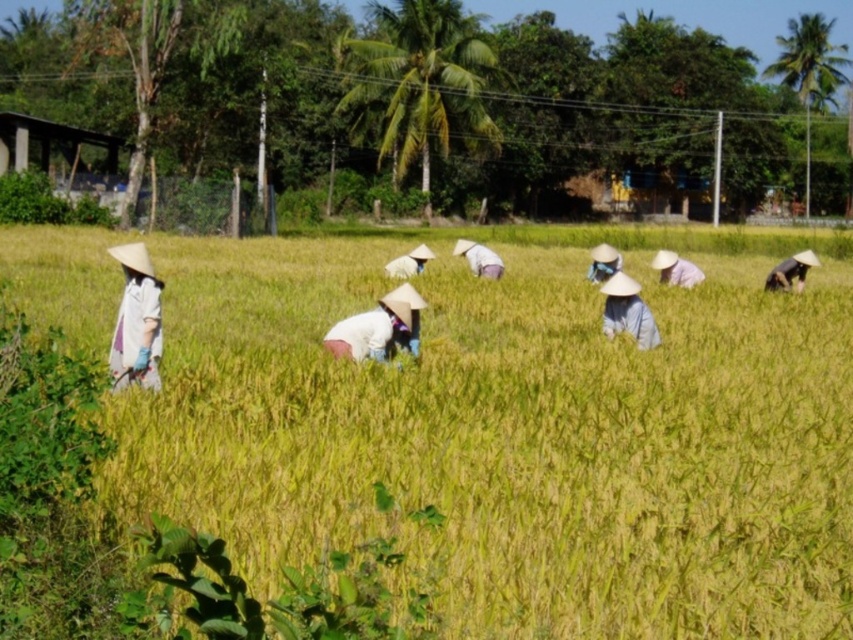
Question: Considering the relative positions of white cotton hat at center and blue fabric headscarf at center in the image provided, where is white cotton hat at center located with respect to blue fabric headscarf at center?

Choices:
 (A) right
 (B) left

Answer: (B)

Question: Considering the real-world distances, which object is closest to the white fabric hat at center?

Choices:
 (A) yellow-green grass at center
 (B) matte straw hat at center
 (C) white fabric at center

Answer: (B)

Question: Does white fabric at center have a lesser width compared to blue fabric headscarf at center?

Choices:
 (A) yes
 (B) no

Answer: (A)

Question: In this image, where is yellow-green grass at center located relative to matte straw hat at center?

Choices:
 (A) above
 (B) below

Answer: (B)

Question: Based on their relative distances, which object is farther from the matte straw hat at center?

Choices:
 (A) white cotton hat at left
 (B) white cotton hat at center
 (C) light blue fabric hat at center

Answer: (A)

Question: Among these points, which one is farthest from the camera?

Choices:
 (A) (618, 300)
 (B) (691, 269)
 (C) (805, 259)
 (D) (762, 484)

Answer: (B)